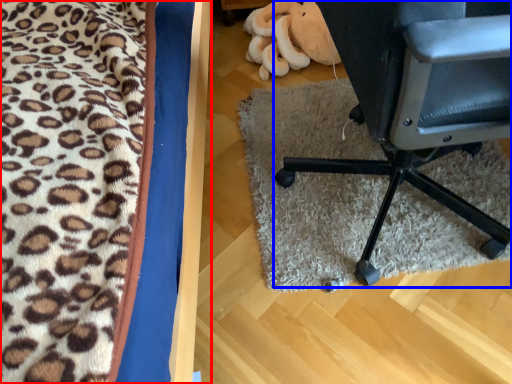
Question: Which of the following is the farthest to the observer, furniture (highlighted by a red box) or chair (highlighted by a blue box)?

Choices:
 (A) furniture
 (B) chair

Answer: (B)